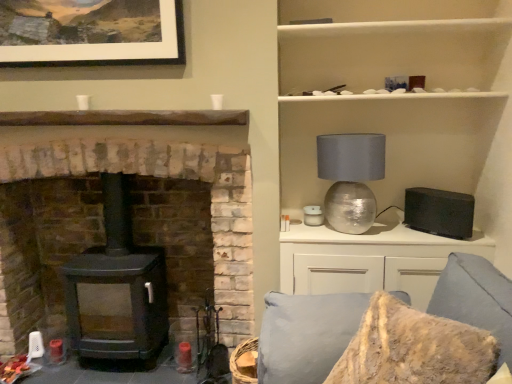
What are the coordinates of `metallic silver sphere at upper right` in the screenshot? It's located at (350, 178).

What is the approximate width of matte black wood stove at left?

The width of matte black wood stove at left is 27.01 inches.

The height and width of the screenshot is (384, 512). What do you see at coordinates (132, 231) in the screenshot?
I see `matte black wood stove at left` at bounding box center [132, 231].

Find the location of a particular element. white matte cabinet at upper right is located at coordinates (391, 53).

This screenshot has width=512, height=384. What do you see at coordinates (119, 284) in the screenshot? I see `black matte wood burning stove at left` at bounding box center [119, 284].

Locate an element on the screen. This screenshot has height=384, width=512. black matte speaker at right is located at coordinates (439, 212).

Considering the sizes of black matte wood burning stove at left and black matte speaker at right in the image, is black matte wood burning stove at left wider or thinner than black matte speaker at right?

Clearly, black matte wood burning stove at left has more width compared to black matte speaker at right.

Is black matte wood burning stove at left touching black matte speaker at right?

No.

Is black matte wood burning stove at left further to camera compared to black matte speaker at right?

Yes, it is behind black matte speaker at right.

Is black matte wood burning stove at left oriented towards black matte speaker at right?

No, black matte wood burning stove at left is not aimed at black matte speaker at right.

Which of these two, black matte wood burning stove at left or metallic silver sphere at upper right, stands taller?

black matte wood burning stove at left is taller.

Is black matte wood burning stove at left surrounding metallic silver sphere at upper right?

No.

Considering the relative sizes of black matte wood burning stove at left and metallic silver sphere at upper right in the image provided, is black matte wood burning stove at left bigger than metallic silver sphere at upper right?

Yes, black matte wood burning stove at left is bigger than metallic silver sphere at upper right.

From the image's perspective, is black matte wood burning stove at left below metallic silver sphere at upper right?

Correct, black matte wood burning stove at left appears lower than metallic silver sphere at upper right in the image.

Is white matte cabinet at upper right to the left or to the right of matte white picture frame at upper center in the image?

From the image, it's evident that white matte cabinet at upper right is to the right of matte white picture frame at upper center.

Which is behind, point (479, 71) or point (17, 25)?

The point (479, 71) is farther.

Considering the relative sizes of white matte cabinet at upper right and matte white picture frame at upper center in the image provided, is white matte cabinet at upper right smaller than matte white picture frame at upper center?

No.

Between white matte cabinet at upper right and matte white picture frame at upper center, which one is positioned in front?

Positioned in front is white matte cabinet at upper right.

What's the angular difference between white glossy cabinet at upper right and matte white picture frame at upper center's facing directions?

white glossy cabinet at upper right and matte white picture frame at upper center are facing 0.374 degrees away from each other.

Between white glossy cabinet at upper right and matte white picture frame at upper center, which one has larger width?

white glossy cabinet at upper right is wider.

In the scene shown: Can you see white glossy cabinet at upper right touching matte white picture frame at upper center?

No, white glossy cabinet at upper right is not with matte white picture frame at upper center.

From their relative heights in the image, would you say black matte speaker at right is taller or shorter than matte white picture frame at upper center?

Considering their sizes, black matte speaker at right has less height than matte white picture frame at upper center.

Could you tell me if black matte speaker at right is turned towards matte white picture frame at upper center?

No, black matte speaker at right is not turned towards matte white picture frame at upper center.

I want to click on appliance below the matte white picture frame at upper center (from the image's perspective), so click(439, 212).

Does point (426, 218) come closer to viewer compared to point (113, 22)?

No, (426, 218) is further to viewer.

Does point (103, 310) appear closer or farther from the camera than point (292, 359)?

Point (103, 310) appears to be farther away from the viewer than point (292, 359).

From a real-world perspective, which object stands above the other?

In real-world perspective, matte black wood stove at left is above.

Who is bigger, matte black wood stove at left or textured gray couch at lower right?

matte black wood stove at left.

Is metallic silver sphere at upper right in front of or behind matte white picture frame at upper center in the image?

Clearly, metallic silver sphere at upper right is behind matte white picture frame at upper center.

Which is more to the left, metallic silver sphere at upper right or matte white picture frame at upper center?

Positioned to the left is matte white picture frame at upper center.

Is metallic silver sphere at upper right outside of matte white picture frame at upper center?

Yes, metallic silver sphere at upper right is not within matte white picture frame at upper center.

Looking at the image, does metallic silver sphere at upper right seem bigger or smaller compared to matte white picture frame at upper center?

Clearly, metallic silver sphere at upper right is larger in size than matte white picture frame at upper center.

Locate an element on the screen. The image size is (512, 384). appliance in front of the black matte wood burning stove at left is located at coordinates (439, 212).

This screenshot has height=384, width=512. In order to click on table lamp above the black matte wood burning stove at left (from the image's perspective) in this screenshot , I will do `click(350, 178)`.

Looking at the image, which one is located closer to black matte wood burning stove at left, matte black wood stove at left or matte white picture frame at upper center?

Based on the image, matte black wood stove at left appears to be nearer to black matte wood burning stove at left.

From the image, which object appears to be farther from metallic silver sphere at upper right, matte white picture frame at upper center or textured gray couch at lower right?

matte white picture frame at upper center is positioned further to the anchor metallic silver sphere at upper right.

Estimate the real-world distances between objects in this image. Which object is closer to matte white picture frame at upper center, black matte wood burning stove at left or metallic silver sphere at upper right?

Based on the image, black matte wood burning stove at left appears to be nearer to matte white picture frame at upper center.

Based on their spatial positions, is white matte cabinet at upper right or textured gray couch at lower right further from black matte wood burning stove at left?

white matte cabinet at upper right.

Looking at the image, which one is located closer to matte white picture frame at upper center, white matte cabinet at upper right or metallic silver sphere at upper right?

white matte cabinet at upper right is closer to matte white picture frame at upper center.

When comparing their distances from textured gray couch at lower right, does black matte wood burning stove at left or white matte cabinet at upper right seem closer?

black matte wood burning stove at left.

Based on their spatial positions, is white glossy cabinet at upper right or metallic silver sphere at upper right closer to white matte cabinet at upper right?

Among the two, metallic silver sphere at upper right is located nearer to white matte cabinet at upper right.

Considering their positions, is black matte speaker at right positioned closer to white matte cabinet at upper right than metallic silver sphere at upper right?

metallic silver sphere at upper right is closer to white matte cabinet at upper right.

This screenshot has width=512, height=384. What are the coordinates of `table lamp between matte black wood stove at left and textured gray couch at lower right from left to right` in the screenshot? It's located at (350, 178).

Locate an element on the screen. This screenshot has width=512, height=384. wood burning stove between matte black wood stove at left and white glossy cabinet at upper right is located at coordinates (119, 284).

Where is `fireplace situated between matte white picture frame at upper center and white glossy cabinet at upper right from left to right`? The height and width of the screenshot is (384, 512). fireplace situated between matte white picture frame at upper center and white glossy cabinet at upper right from left to right is located at coordinates (132, 231).

Where is `fireplace situated between matte white picture frame at upper center and textured gray couch at lower right from left to right`? fireplace situated between matte white picture frame at upper center and textured gray couch at lower right from left to right is located at coordinates (132, 231).